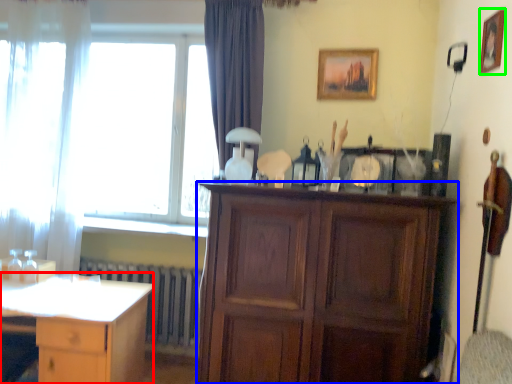
Question: Which is farther away from desk (highlighted by a red box)? cabinetry (highlighted by a blue box) or picture frame (highlighted by a green box)?

Choices:
 (A) cabinetry
 (B) picture frame

Answer: (B)